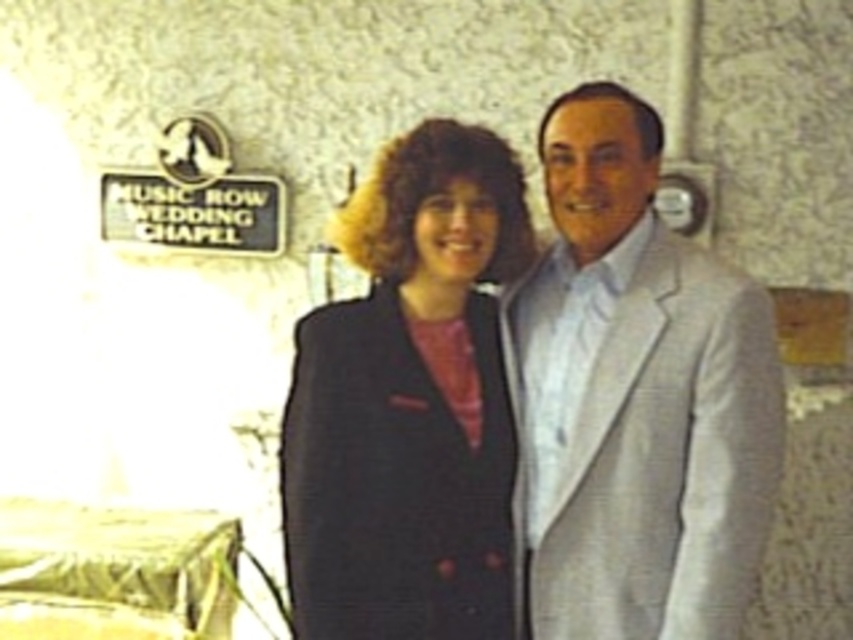
Who is positioned more to the right, light gray textured suit at center or matte black blazer at center?

Positioned to the right is light gray textured suit at center.

Who is lower down, light gray textured suit at center or matte black blazer at center?

matte black blazer at center is below.

Locate an element on the screen. This screenshot has width=853, height=640. light gray textured suit at center is located at coordinates (636, 397).